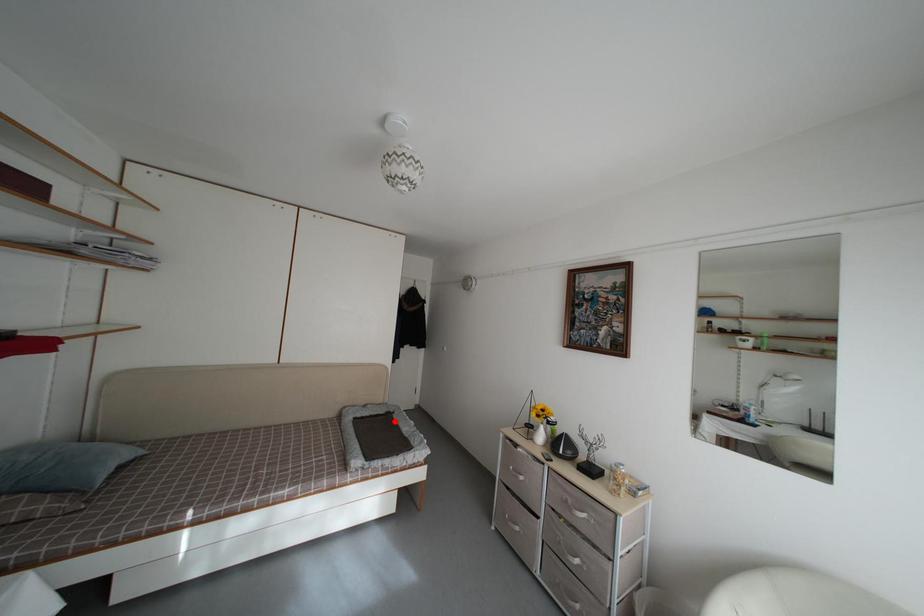
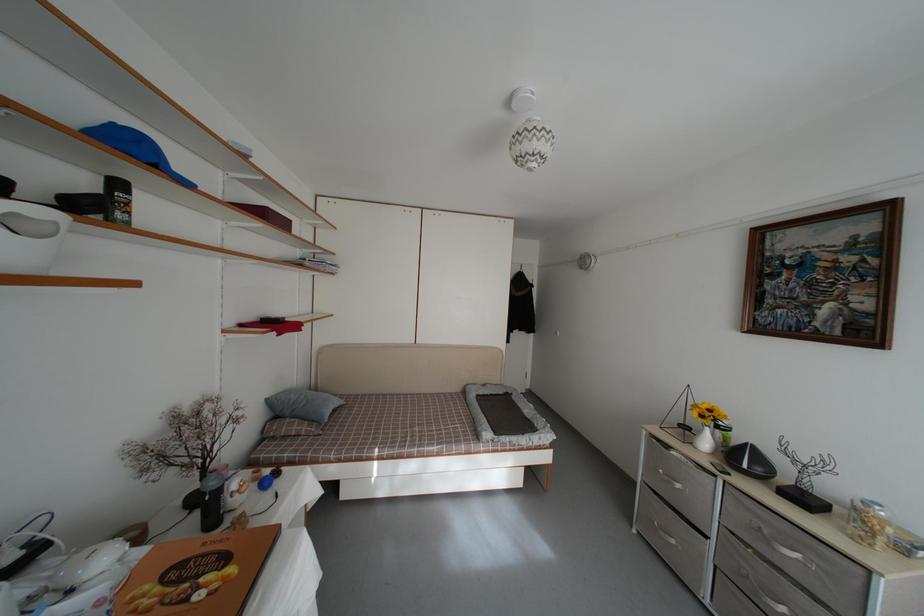
Find the pixel in the second image that matches the highlighted location in the first image.

(513, 402)